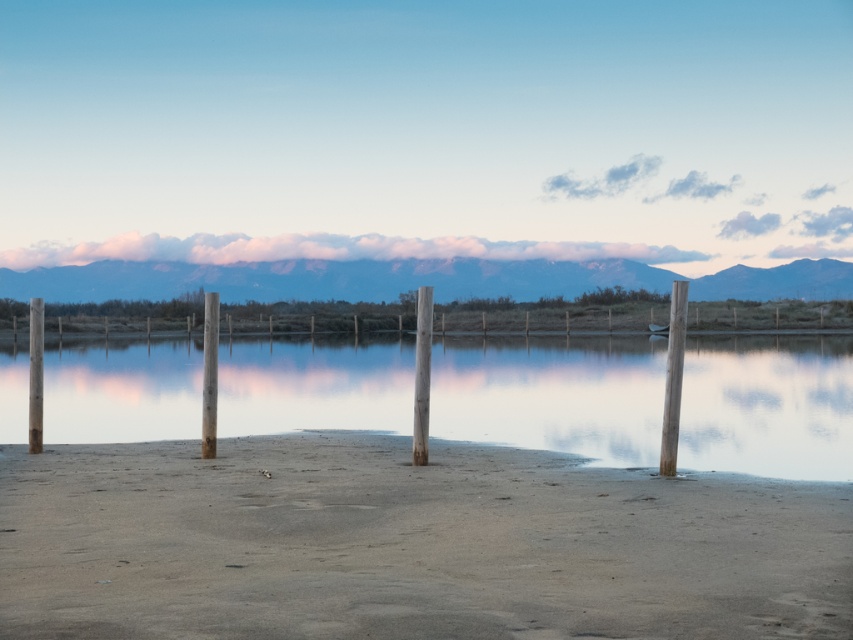
Who is more forward, (842, 397) or (39, 326)?

Point (39, 326) is in front.

Who is lower down, smooth reflective water at center or smooth wood post at left?

smooth reflective water at center is below.

Identify the location of smooth reflective water at center. (552, 394).

The height and width of the screenshot is (640, 853). Find the location of `smooth reflective water at center`. smooth reflective water at center is located at coordinates (552, 394).

Is point (676, 483) more distant than point (268, 388)?

No, (676, 483) is in front of (268, 388).

Between sandy at lower center and smooth reflective water at center, which one appears on the right side from the viewer's perspective?

smooth reflective water at center is more to the right.

Is point (393, 445) positioned in front of point (817, 380)?

Yes, it is in front of point (817, 380).

You are a GUI agent. You are given a task and a screenshot of the screen. Output one action in this format:
    pyautogui.click(x=<x>, y=<y>)
    Task: Click on the sandy at lower center
    
    Given the screenshot: What is the action you would take?
    pyautogui.click(x=408, y=545)

Is point (213, 294) farther from camera compared to point (35, 426)?

No, it is in front of (35, 426).

Which is in front, point (202, 448) or point (33, 301)?

Point (202, 448) is more forward.

Where is `wooden post at center`? wooden post at center is located at coordinates point(209,376).